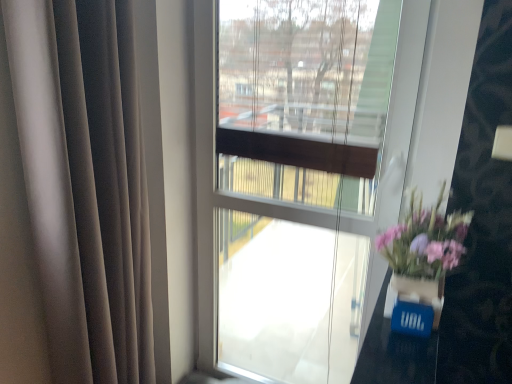
Question: Should I look upward or downward to see purple floral bouquet at right?

Choices:
 (A) up
 (B) down

Answer: (B)

Question: Is purple floral bouquet at right smaller than blue matte glass vase at lower right?

Choices:
 (A) no
 (B) yes

Answer: (A)

Question: From a real-world perspective, is purple floral bouquet at right beneath blue matte glass vase at lower right?

Choices:
 (A) yes
 (B) no

Answer: (B)

Question: From the image's perspective, does purple floral bouquet at right appear lower than blue matte glass vase at lower right?

Choices:
 (A) no
 (B) yes

Answer: (A)

Question: Is purple floral bouquet at right at the right side of blue matte glass vase at lower right?

Choices:
 (A) yes
 (B) no

Answer: (A)

Question: Does purple floral bouquet at right appear on the left side of blue matte glass vase at lower right?

Choices:
 (A) yes
 (B) no

Answer: (B)

Question: Can you confirm if purple floral bouquet at right is shorter than blue matte glass vase at lower right?

Choices:
 (A) no
 (B) yes

Answer: (A)

Question: Could you tell me if blue matte glass vase at lower right is facing purple floral bouquet at right?

Choices:
 (A) yes
 (B) no

Answer: (B)

Question: From a real-world perspective, is blue matte glass vase at lower right on top of purple floral bouquet at right?

Choices:
 (A) yes
 (B) no

Answer: (B)

Question: From the image's perspective, is blue matte glass vase at lower right above purple floral bouquet at right?

Choices:
 (A) yes
 (B) no

Answer: (B)

Question: Is blue matte glass vase at lower right in front of purple floral bouquet at right?

Choices:
 (A) yes
 (B) no

Answer: (A)

Question: From a real-world perspective, is blue matte glass vase at lower right physically below purple floral bouquet at right?

Choices:
 (A) yes
 (B) no

Answer: (A)

Question: Does blue matte glass vase at lower right have a greater width compared to purple floral bouquet at right?

Choices:
 (A) yes
 (B) no

Answer: (B)

Question: Is purple floral bouquet at right inside the boundaries of blue matte glass vase at lower right, or outside?

Choices:
 (A) inside
 (B) outside

Answer: (B)